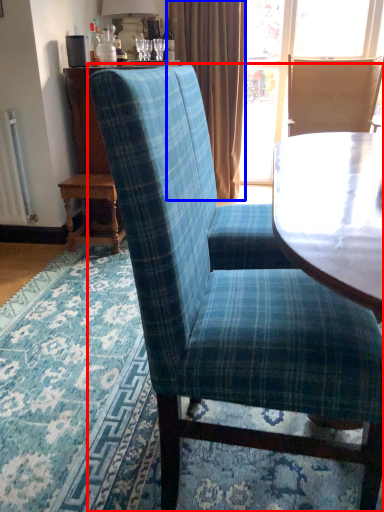
Question: Which of the following is the closest to the observer, chair (highlighted by a red box) or curtain (highlighted by a blue box)?

Choices:
 (A) chair
 (B) curtain

Answer: (A)